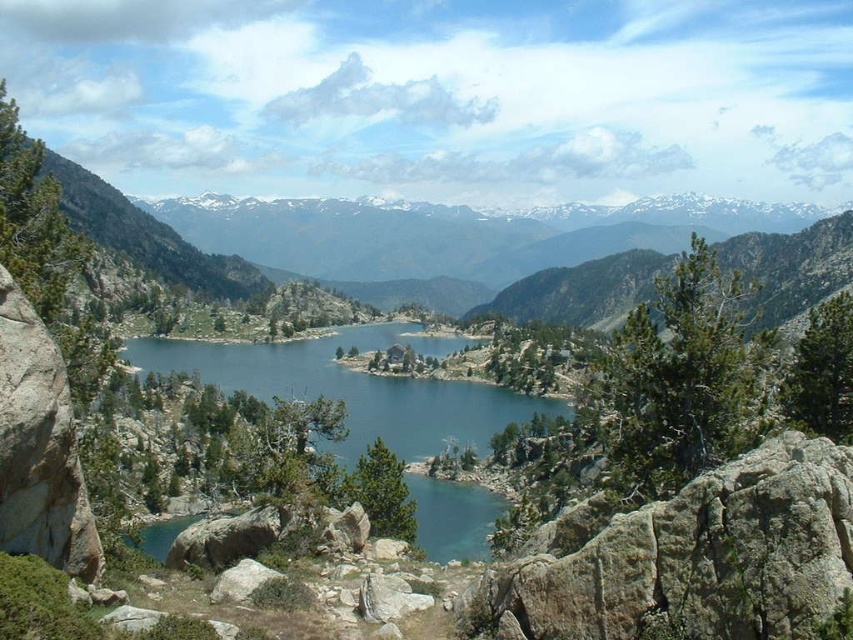
You are a hiker planning to cross the lake using a small boat. You have two points marked on your map as potential landing spots. The first is at point (235, 228) and the second is at point (495, 404). Which landing spot is closer to your current position on the lakeshore?

Point (235, 228) is closer to your current position because it is further to the viewer than point (495, 404), meaning it is physically nearer to you on the lakeshore.

You are a hiker planning to cross the lake using a small boat. The boat can only carry you and one object from the image. Which object, the green grassy mountain at center or another object not mentioned, would you choose to bring with you for navigation?

The question mentions only the green grassy mountain at center, but since the boat can only carry one object, you must choose between the mountain and another object. However, the mountain is a natural feature and cannot be moved. Therefore, you should prioritize bringing an object not mentioned for navigation.